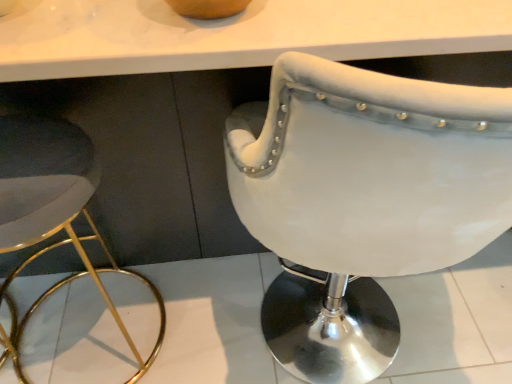
This screenshot has height=384, width=512. Identify the location of white leather stool at left. (53, 211).

What do you see at coordinates (53, 211) in the screenshot? This screenshot has height=384, width=512. I see `white leather stool at left` at bounding box center [53, 211].

The image size is (512, 384). What do you see at coordinates (362, 200) in the screenshot?
I see `white leather chair at center` at bounding box center [362, 200].

Identify the location of white leather chair at center. (362, 200).

The width and height of the screenshot is (512, 384). I want to click on white leather stool at left, so click(53, 211).

Can you confirm if white leather chair at center is positioned to the right of white leather stool at left?

Yes.

Based on the photo, is white leather chair at center positioned in front of white leather stool at left?

Yes.

Is point (319, 272) closer or farther from the camera than point (15, 342)?

Point (319, 272).

From the image's perspective, who appears lower, white leather chair at center or white leather stool at left?

white leather stool at left.

From a real-world perspective, is white leather chair at center on top of white leather stool at left?

Yes, from a real-world perspective, white leather chair at center is above white leather stool at left.

Based on the photo, does white leather chair at center have a lesser width compared to white leather stool at left?

No, white leather chair at center is not thinner than white leather stool at left.

Considering the sizes of white leather chair at center and white leather stool at left in the image, is white leather chair at center taller or shorter than white leather stool at left?

In the image, white leather chair at center appears to be taller than white leather stool at left.

Who is smaller, white leather chair at center or white leather stool at left?

Smaller between the two is white leather stool at left.

Can we say white leather chair at center lies outside white leather stool at left?

white leather chair at center is positioned outside white leather stool at left.

Is white leather chair at center next to white leather stool at left?

white leather chair at center is not next to white leather stool at left, and they're not touching.

Is white leather chair at center oriented away from white leather stool at left?

No.

How far apart are white leather chair at center and white leather stool at left?

white leather chair at center and white leather stool at left are 16.68 inches apart from each other.

Find the location of `stool that appears behind the white leather chair at center`. stool that appears behind the white leather chair at center is located at coordinates (53, 211).

Can you confirm if white leather stool at left is positioned to the left of white leather chair at center?

Correct, you'll find white leather stool at left to the left of white leather chair at center.

Which object is closer to the camera, white leather stool at left or white leather chair at center?

Positioned in front is white leather chair at center.

Which point is more distant from viewer, [1,195] or [468,252]?

Positioned behind is point [1,195].

Based on the photo, from the image's perspective, between white leather stool at left and white leather chair at center, who is located below?

white leather stool at left, from the image's perspective.

From a real-world perspective, who is located lower, white leather stool at left or white leather chair at center?

white leather stool at left.

Looking at this image, which of these two, white leather stool at left or white leather chair at center, is thinner?

white leather stool at left.

Which of these two, white leather stool at left or white leather chair at center, stands shorter?

white leather stool at left.

Considering the sizes of white leather stool at left and white leather chair at center in the image, is white leather stool at left bigger or smaller than white leather chair at center?

white leather stool at left is smaller than white leather chair at center.

Choose the correct answer: Is white leather stool at left inside white leather chair at center or outside it?

white leather stool at left is not inside white leather chair at center, it's outside.

Is white leather stool at left not close to white leather chair at center?

white leather stool at left is actually quite close to white leather chair at center.

Is white leather stool at left facing towards white leather chair at center?

No, white leather stool at left is not aimed at white leather chair at center.

What's the angular difference between white leather stool at left and white leather chair at center's facing directions?

The facing directions of white leather stool at left and white leather chair at center are 4.19 degrees apart.

The width and height of the screenshot is (512, 384). I want to click on stool below the white leather chair at center (from the image's perspective), so click(53, 211).

At what (x,y) coordinates should I click in order to perform the action: click on chair above the white leather stool at left (from a real-world perspective). Please return your answer as a coordinate pair (x, y). Image resolution: width=512 pixels, height=384 pixels. Looking at the image, I should click on (362, 200).

This screenshot has width=512, height=384. I want to click on stool below the white leather chair at center (from the image's perspective), so click(x=53, y=211).